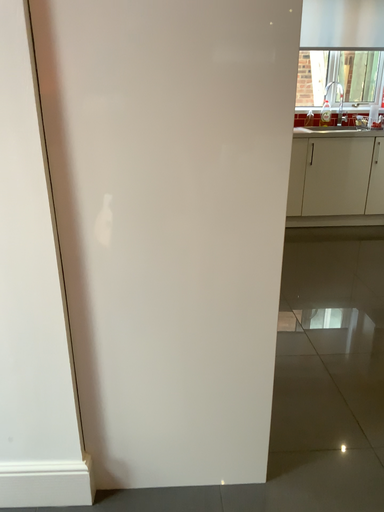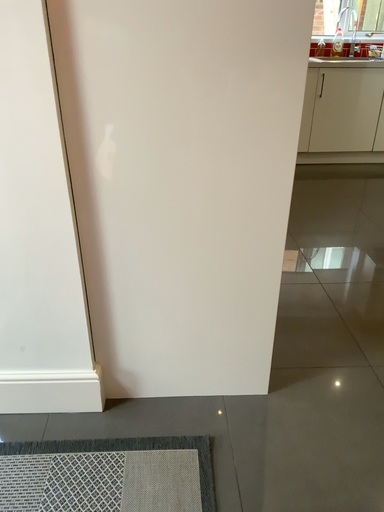
Question: Which way did the camera rotate in the video?

Choices:
 (A) rotated upward
 (B) rotated downward

Answer: (B)